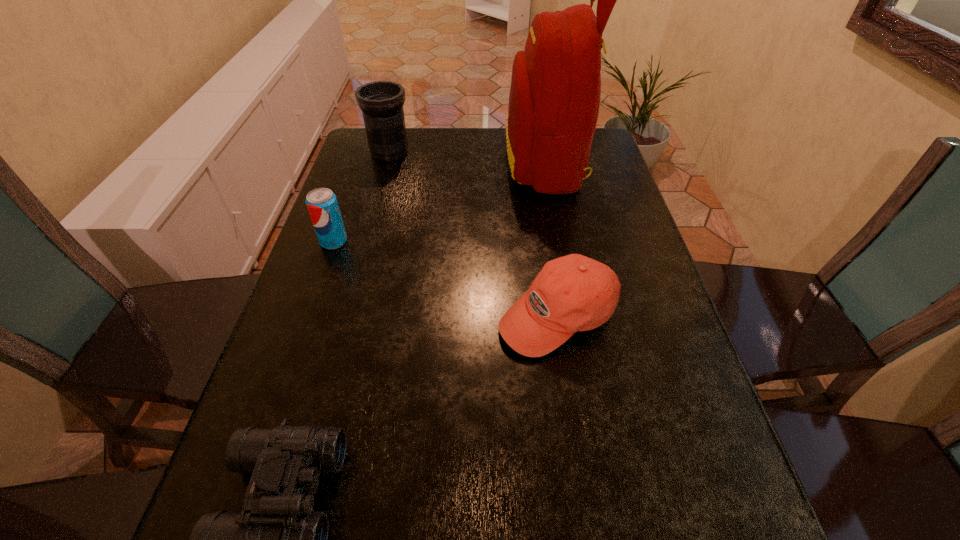
This screenshot has height=540, width=960. I want to click on the tallest object, so click(x=554, y=100).

The image size is (960, 540). In order to click on telephoto lens in this screenshot , I will do `click(381, 102)`.

I want to click on the third farthest object, so click(x=322, y=204).

Find the location of `the second nearest object`. the second nearest object is located at coordinates (572, 293).

At what (x,y) coordinates should I click in order to perform the action: click on vacant position located 0.280m on the front-facing side of the tallest object. Please return your answer as a coordinate pair (x, y). Looking at the image, I should click on (416, 163).

Find the location of a particular element. The image size is (960, 540). free space located on the front-facing side of the tallest object is located at coordinates (482, 163).

The height and width of the screenshot is (540, 960). Find the location of `blank space located 0.110m on the front-facing side of the tallest object`. blank space located 0.110m on the front-facing side of the tallest object is located at coordinates pos(469,163).

The height and width of the screenshot is (540, 960). Identify the location of vacant space located 0.200m on the right of the telephoto lens. (473, 152).

The width and height of the screenshot is (960, 540). Find the location of `free space located on the back of the soda can`. free space located on the back of the soda can is located at coordinates (359, 170).

I want to click on vacant region located on the back of the baseball cap, so click(537, 181).